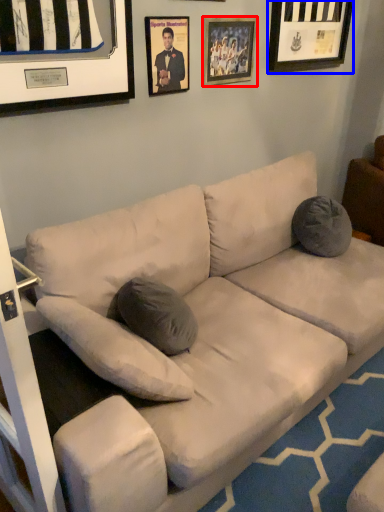
Question: Which of the following is the farthest to the observer, picture frame (highlighted by a red box) or picture frame (highlighted by a blue box)?

Choices:
 (A) picture frame
 (B) picture frame

Answer: (B)